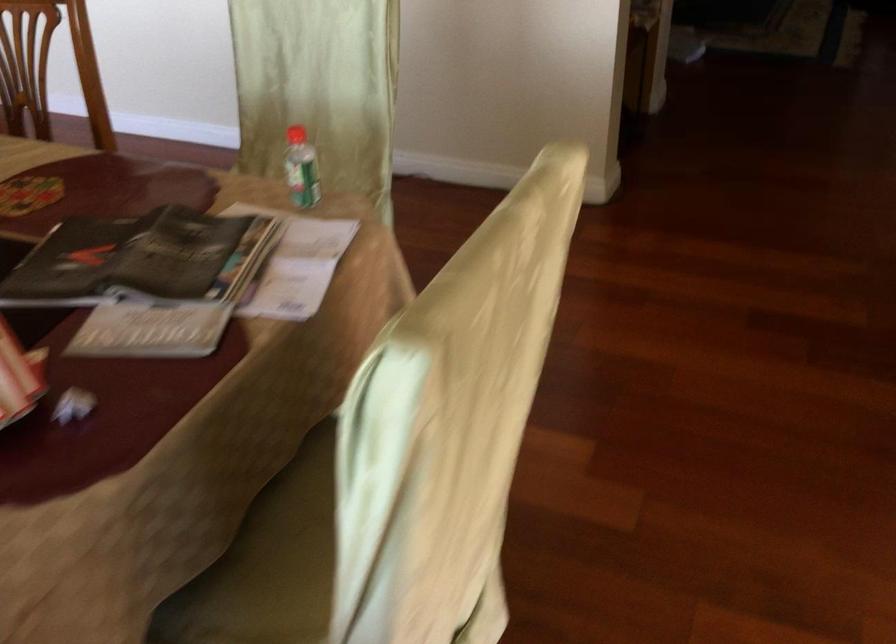
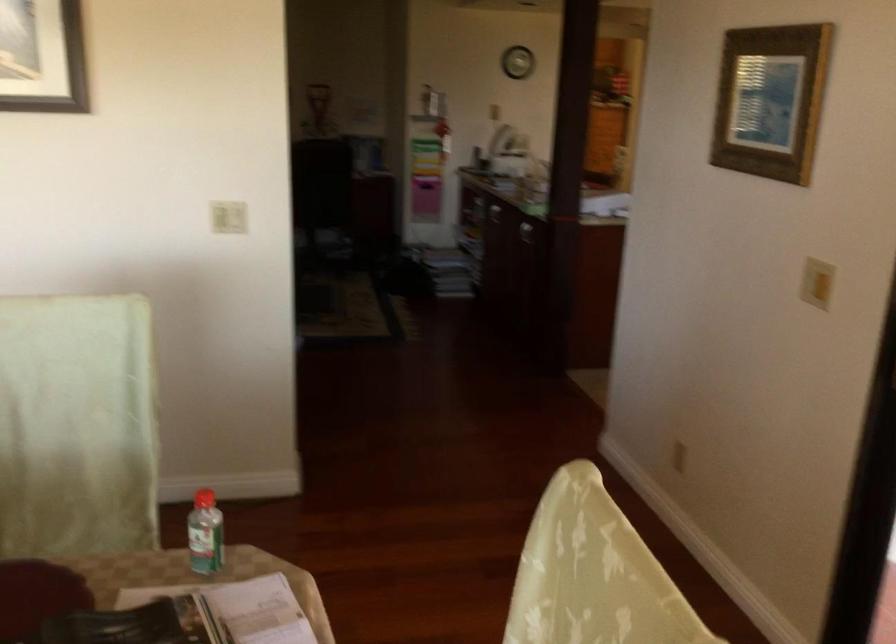
Question: Based on the continuous images, in which direction is the camera rotating? Reply with the corresponding letter.

Choices:
 (A) Left
 (B) Right
 (C) Up
 (D) Down

Answer: (B)